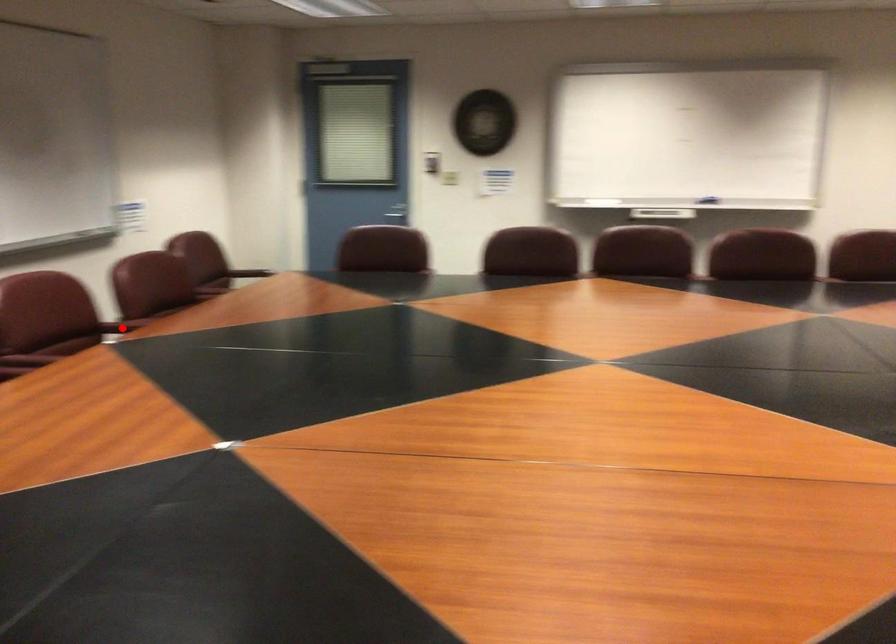
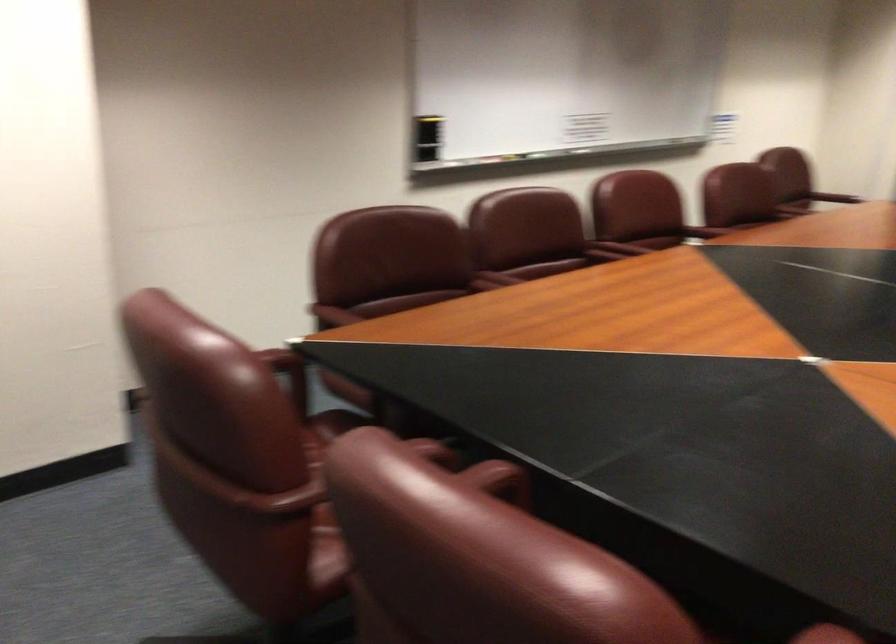
Question: I am providing you with two images of the same scene from different viewpoints. A red point is marked on the first image. Is the red point's position out of view in image 2?

Choices:
 (A) Yes
 (B) No

Answer: (B)